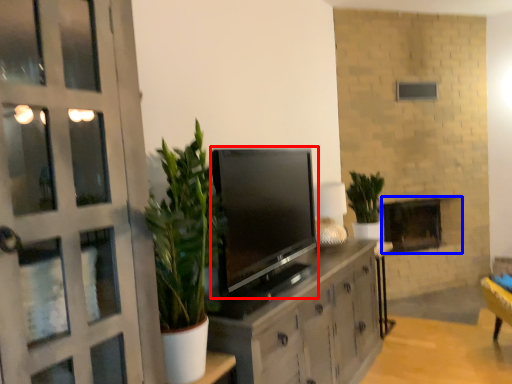
Question: Which of the following is the farthest to the observer, television (highlighted by a red box) or fireplace (highlighted by a blue box)?

Choices:
 (A) television
 (B) fireplace

Answer: (B)